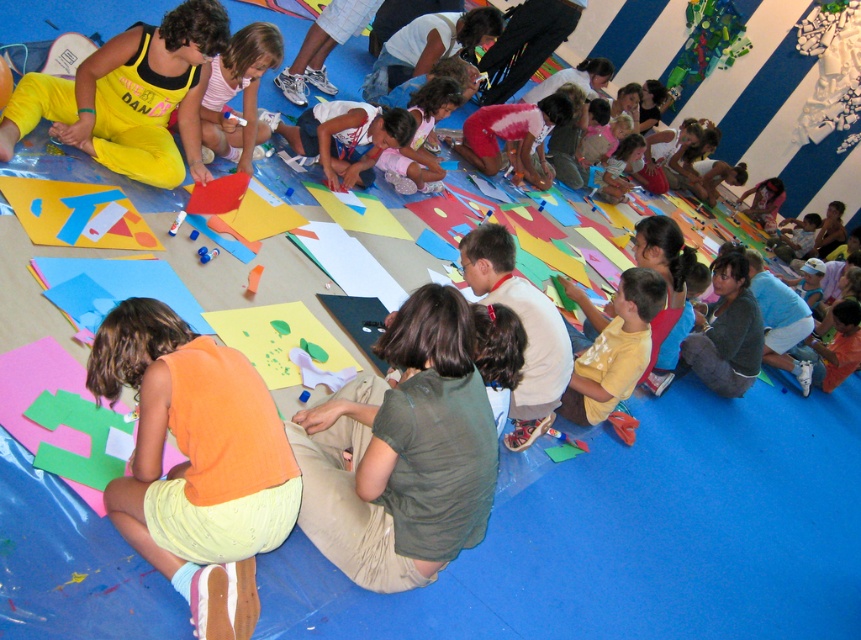
Question: Does yellow matte shirt at lower center appear under pink fabric shirt at center?

Choices:
 (A) yes
 (B) no

Answer: (A)

Question: Which object is closer to the camera taking this photo?

Choices:
 (A) yellow matte shirt at lower center
 (B) dark green shirt at center

Answer: (B)

Question: Which of the following is the farthest from the observer?

Choices:
 (A) (261, 60)
 (B) (401, 355)
 (C) (53, 102)

Answer: (A)

Question: Estimate the real-world distances between objects in this image. Which object is farther from the yellow matte shirt at lower center?

Choices:
 (A) matte khaki pants at center
 (B) velvet yellow pants at left
 (C) fluffy pink sweater at center

Answer: (C)

Question: Is dark green shirt at center further to the viewer compared to pink fabric shirt at center?

Choices:
 (A) no
 (B) yes

Answer: (A)

Question: Can you confirm if orange cotton shirt at lower left is thinner than yellow matte shirt at lower center?

Choices:
 (A) no
 (B) yes

Answer: (A)